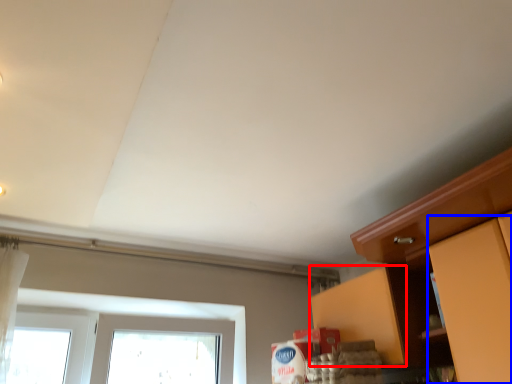
Question: Which object appears farthest to the camera in this image, cabinetry (highlighted by a red box) or cabinetry (highlighted by a blue box)?

Choices:
 (A) cabinetry
 (B) cabinetry

Answer: (A)